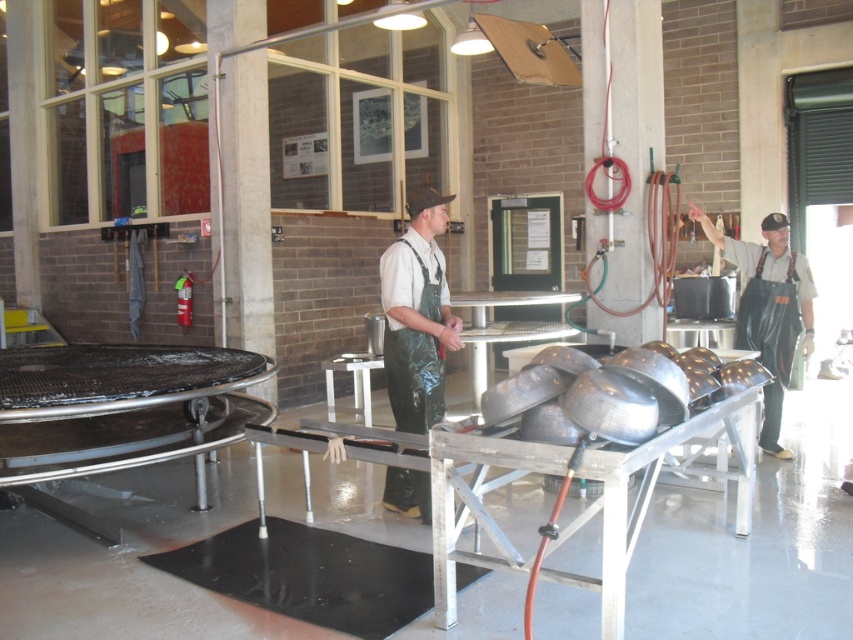
You are a chef preparing for a cooking class and need to choose an apron. You see a green rubber apron at center and a black rubber apron at right. Which apron is smaller in size?

The green rubber apron at center is smaller in size compared to the black rubber apron at right.

You are a chef preparing to put on an apron. You see a green rubber apron at center and a black rubber apron at right. Which apron is shorter in height?

The green rubber apron at center is shorter in height compared to the black rubber apron at right.